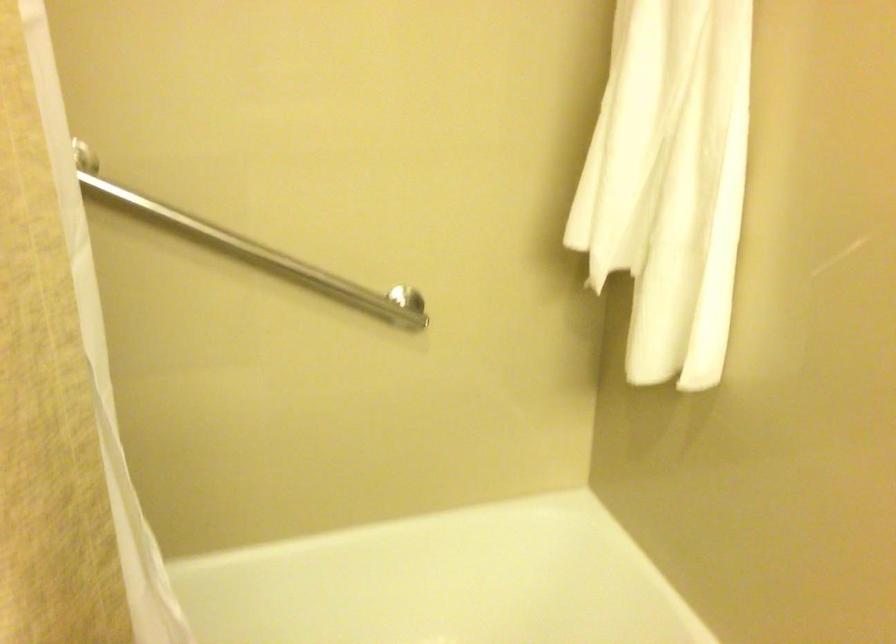
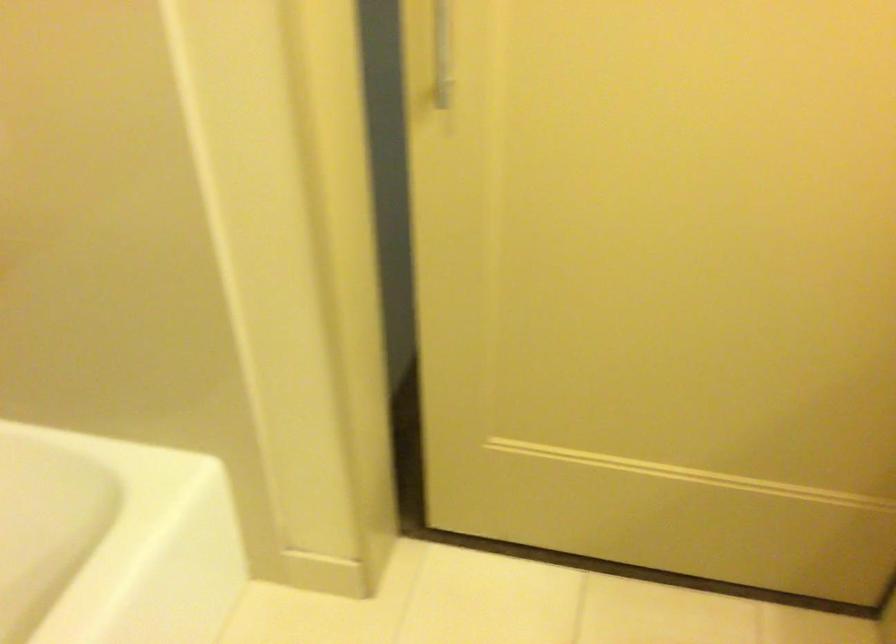
First-person continuous shooting, in which direction is the camera rotating?

The camera's rotation is toward right-down.